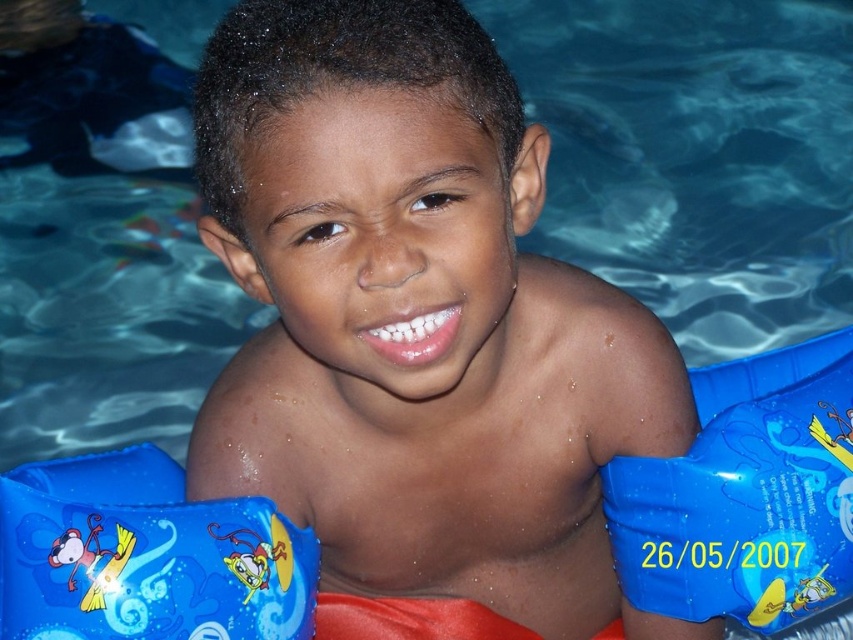
Between blue rubber arm bands at center and blue inflatable arm band at right, which one appears on the left side from the viewer's perspective?

blue rubber arm bands at center

Does blue rubber arm bands at center have a greater width compared to blue inflatable arm band at right?

Yes, blue rubber arm bands at center is wider than blue inflatable arm band at right.

Is point (380, 17) positioned behind point (741, 371)?

No, (380, 17) is closer to viewer.

I want to click on blue rubber arm bands at center, so click(416, 330).

Does point (496, 90) come farther from viewer compared to point (254, 605)?

No, (496, 90) is in front of (254, 605).

Can you confirm if blue rubber arm bands at center is positioned below blue inflatable arm bands at lower left?

Actually, blue rubber arm bands at center is above blue inflatable arm bands at lower left.

Find the location of `blue rubber arm bands at center`. blue rubber arm bands at center is located at coordinates (416, 330).

In the scene shown: Who is higher up, blue inflatable arm band at right or blue inflatable arm bands at lower left?

blue inflatable arm band at right is higher up.

Where is `blue inflatable arm band at right`? blue inflatable arm band at right is located at coordinates (746, 493).